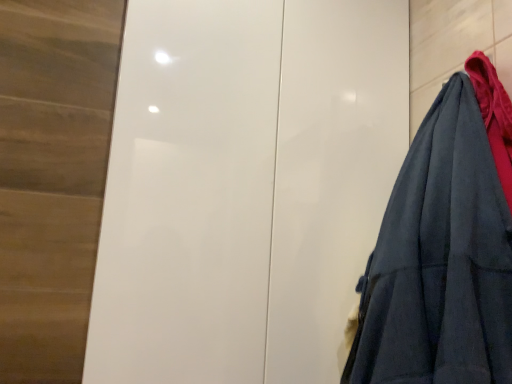
Question: Should I look upward or downward to see dark blue fabric at right?

Choices:
 (A) up
 (B) down

Answer: (B)

Question: Can you confirm if white glossy door at center is positioned to the right of dark blue fabric at right?

Choices:
 (A) yes
 (B) no

Answer: (B)

Question: Is white glossy door at center thinner than dark blue fabric at right?

Choices:
 (A) yes
 (B) no

Answer: (B)

Question: Does white glossy door at center turn towards dark blue fabric at right?

Choices:
 (A) no
 (B) yes

Answer: (B)

Question: Is white glossy door at center bigger than dark blue fabric at right?

Choices:
 (A) yes
 (B) no

Answer: (A)

Question: Are white glossy door at center and dark blue fabric at right located far from each other?

Choices:
 (A) yes
 (B) no

Answer: (B)

Question: From the image's perspective, would you say white glossy door at center is shown under dark blue fabric at right?

Choices:
 (A) no
 (B) yes

Answer: (A)

Question: Does dark blue fabric at right have a larger size compared to white glossy door at center?

Choices:
 (A) yes
 (B) no

Answer: (B)

Question: Is dark blue fabric at right to the right of white glossy door at center from the viewer's perspective?

Choices:
 (A) yes
 (B) no

Answer: (A)

Question: Is dark blue fabric at right in contact with white glossy door at center?

Choices:
 (A) yes
 (B) no

Answer: (B)

Question: Is dark blue fabric at right in front of white glossy door at center?

Choices:
 (A) yes
 (B) no

Answer: (A)

Question: Considering the relative positions of dark blue fabric at right and white glossy door at center in the image provided, is dark blue fabric at right to the left of white glossy door at center from the viewer's perspective?

Choices:
 (A) no
 (B) yes

Answer: (A)

Question: From the image's perspective, does dark blue fabric at right appear lower than white glossy door at center?

Choices:
 (A) no
 (B) yes

Answer: (B)

Question: Is white glossy door at center taller or shorter than dark blue fabric at right?

Choices:
 (A) tall
 (B) short

Answer: (A)